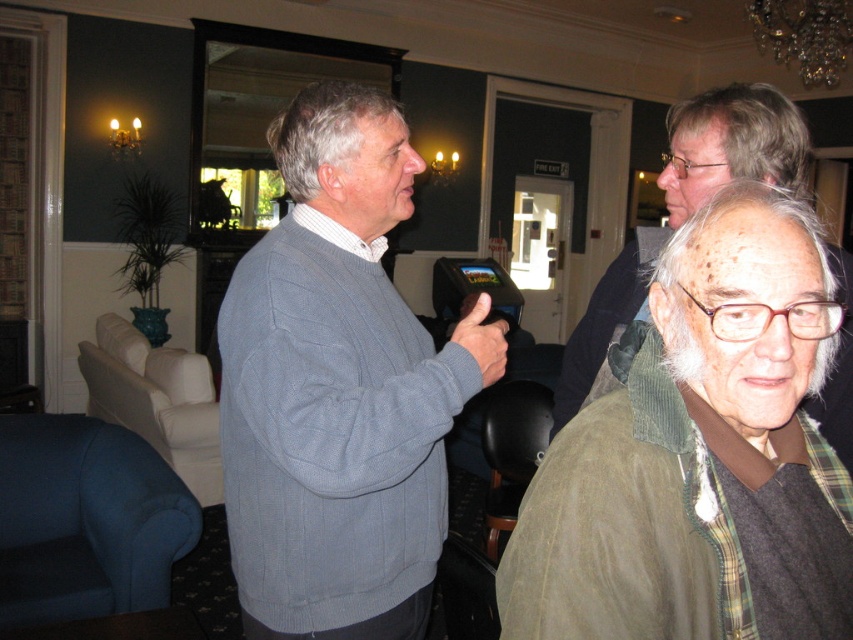
Is green corduroy jacket at center thinner than blue fabric armchair at lower left?

Yes, green corduroy jacket at center is thinner than blue fabric armchair at lower left.

Where is `green corduroy jacket at center`? green corduroy jacket at center is located at coordinates (699, 454).

Is point (596, 323) positioned before point (445, 538)?

Yes, point (596, 323) is closer to viewer.

Who is positioned more to the right, knitted sweater at center or dark brown leather armchair at lower center?

knitted sweater at center is more to the right.

At what (x,y) coordinates should I click in order to perform the action: click on knitted sweater at center. Please return your answer as a coordinate pair (x, y). Looking at the image, I should click on (686, 205).

Is knitted sweater at center smaller than green corduroy jacket at upper right?

Correct, knitted sweater at center occupies less space than green corduroy jacket at upper right.

Is point (744, 154) positioned behind point (573, 358)?

No, (744, 154) is closer to viewer.

Where is `knitted sweater at center`? The image size is (853, 640). knitted sweater at center is located at coordinates (686, 205).